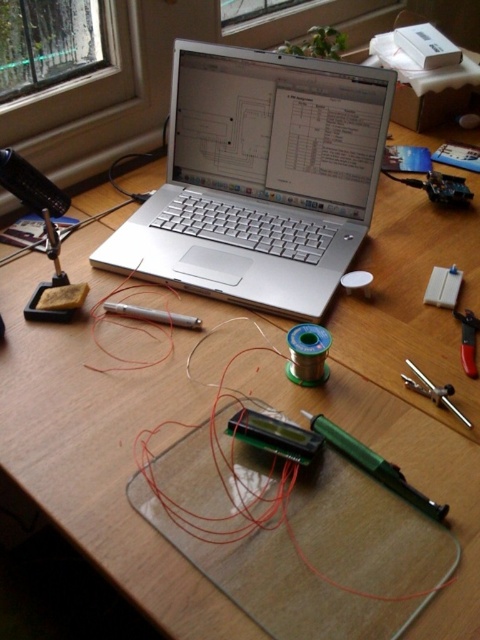
You are setting up a workspace and need to place both the silver metallic laptop at center and the metallic silver compass at right on a shelf. The shelf has limited space. Based on their sizes, which object should you place first to ensure both fit?

The silver metallic laptop at center is bigger than the metallic silver compass at right, so you should place the silver metallic laptop at center first to ensure both fit on the shelf.

You are working on a project and need to access both the silver metallic laptop at center and the metallic silver compass at right. Which object is closer to you if you are sitting at the desk?

The silver metallic laptop at center is closer to you since the metallic silver compass at right is positioned behind it.

You are an engineer working on a project and need to place a 18 inch ruler between the silver metallic laptop at center and the metallic silver compass at right. Can the ruler fit between them without overlapping either object?

The distance between the silver metallic laptop at center and the metallic silver compass at right is 17.97 inches. Since the ruler is 18 inches long, it cannot fit between them without overlapping either object.